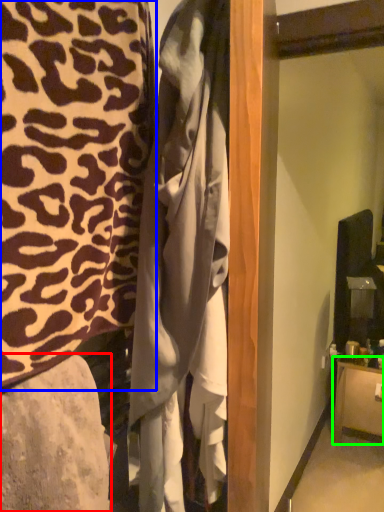
Question: Estimate the real-world distances between objects in this image. Which object is farther from furniture (highlighted by a red box), furniture (highlighted by a blue box) or furniture (highlighted by a green box)?

Choices:
 (A) furniture
 (B) furniture

Answer: (B)